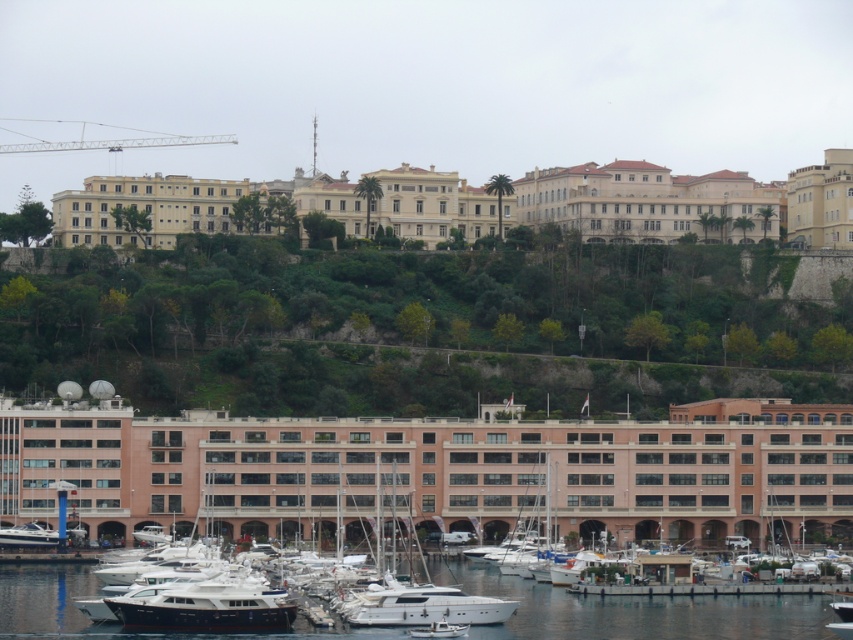
Does point (372, 592) lie behind point (42, 536)?

No, it is not.

Is the position of white glossy yacht at center more distant than that of white glossy boat at lower left?

No.

Does point (405, 611) come behind point (16, 545)?

No, (405, 611) is in front of (16, 545).

Where is `white glossy yacht at center`? The image size is (853, 640). white glossy yacht at center is located at coordinates (422, 605).

Can you confirm if white glossy water at lower center is positioned below white glossy yacht at center?

Yes.

Is point (735, 596) positioned after point (372, 621)?

Yes, it is behind point (372, 621).

Who is more distant from viewer, (6, 609) or (473, 621)?

The point (6, 609) is more distant.

Image resolution: width=853 pixels, height=640 pixels. Identify the location of white glossy water at lower center. (x=635, y=611).

Which is in front, point (663, 600) or point (3, 536)?

Positioned in front is point (663, 600).

Consider the image. Who is shorter, white glossy water at lower center or white glossy boat at lower left?

Standing shorter between the two is white glossy boat at lower left.

The height and width of the screenshot is (640, 853). What do you see at coordinates (635, 611) in the screenshot?
I see `white glossy water at lower center` at bounding box center [635, 611].

The height and width of the screenshot is (640, 853). Find the location of `white glossy water at lower center`. white glossy water at lower center is located at coordinates (635, 611).